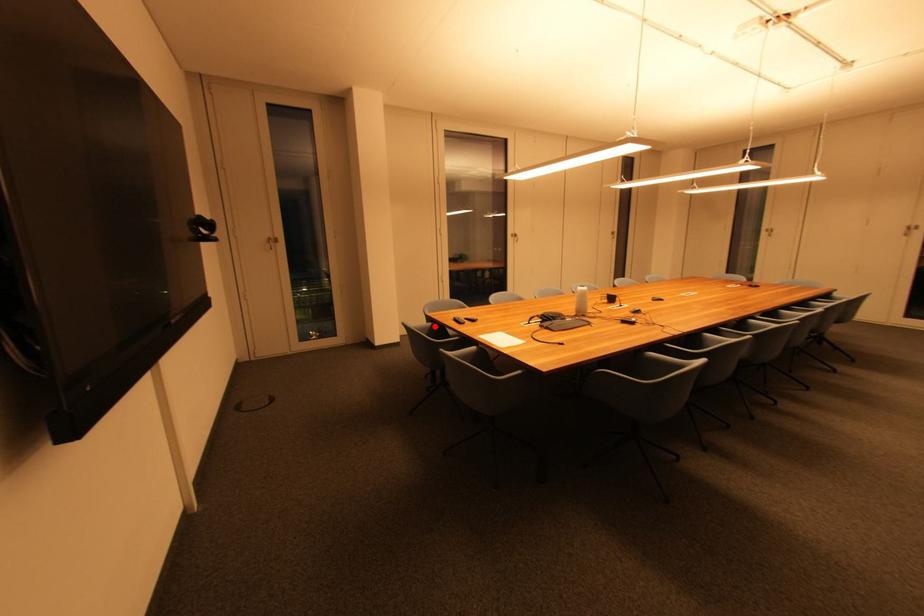
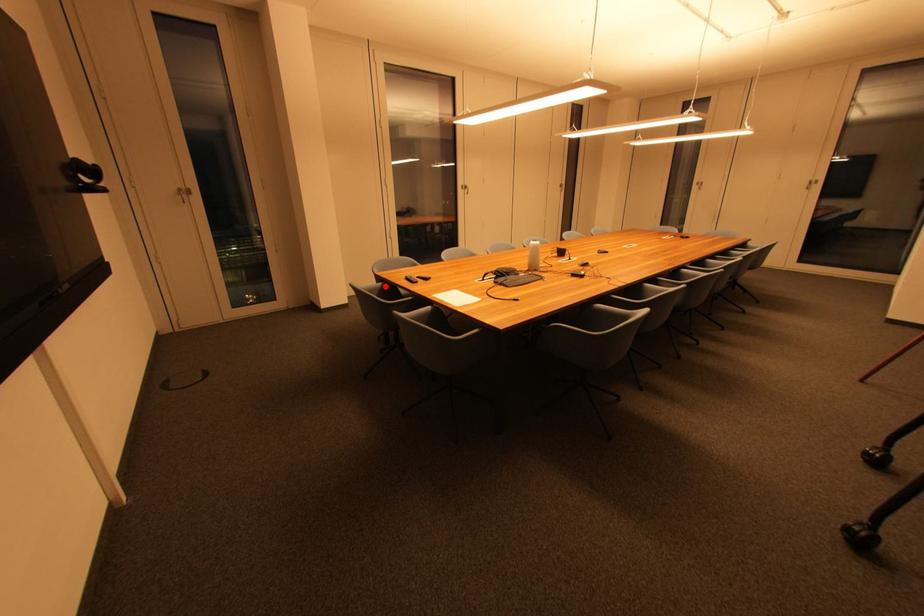
I am providing you with two images of the same scene from different viewpoints. A red point is marked on the first image and another point is marked on the second image. Does the point marked in image1 correspond to the same location as the one in image2?

Yes